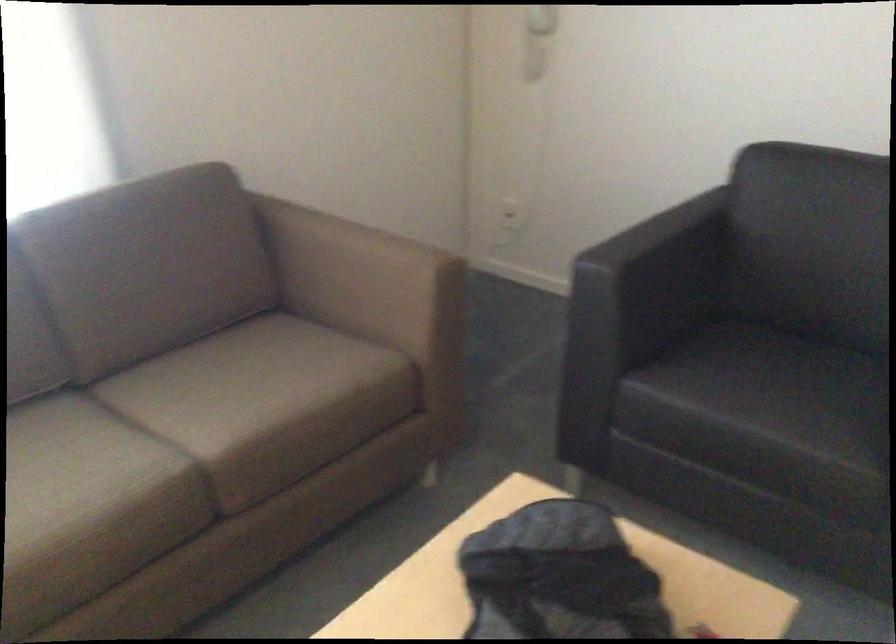
Locate an element on the screen. black backpack is located at coordinates (558, 576).